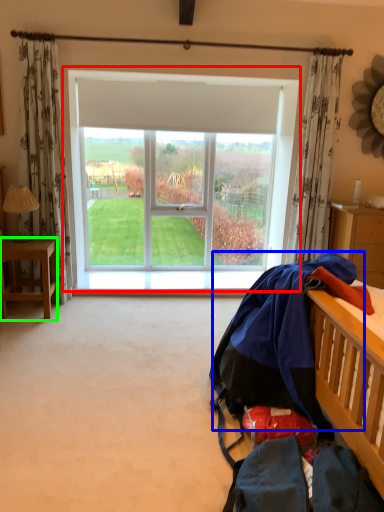
Question: Estimate the real-world distances between objects in this image. Which object is farther from window (highlighted by a red box), clothing (highlighted by a blue box) or desk (highlighted by a green box)?

Choices:
 (A) clothing
 (B) desk

Answer: (A)